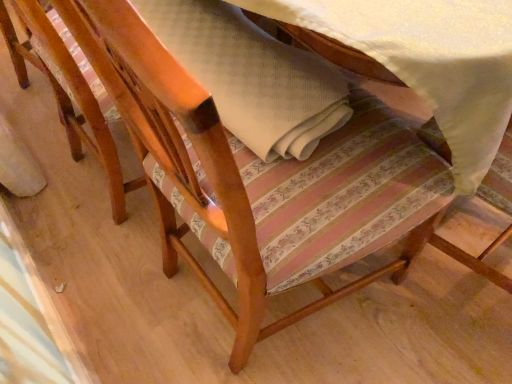
Locate an element on the screen. free space above white textured fabric at center (from a real-world perspective) is located at coordinates (210, 50).